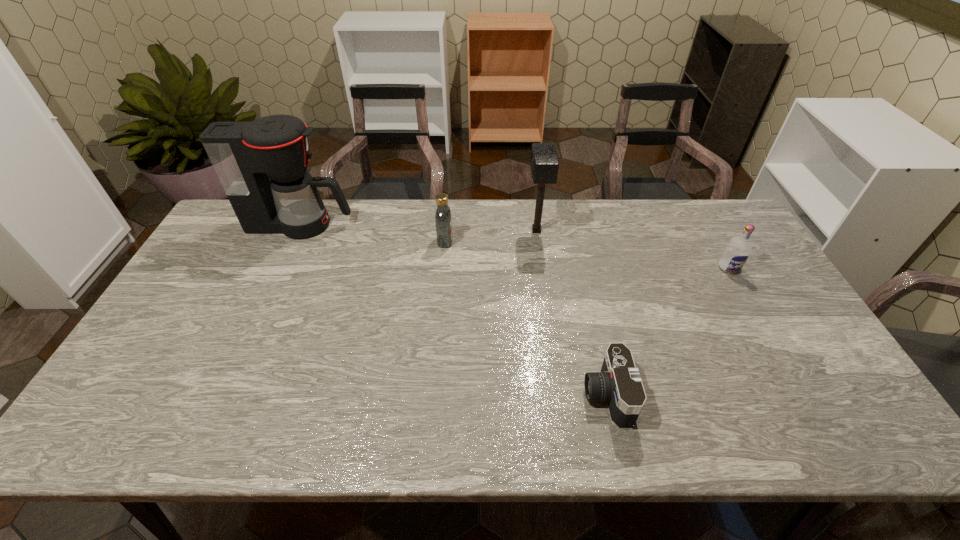
Identify the location of vacant space positioned pour from the carafe of the leftmost object. (417, 225).

In order to click on vacant space located 0.120m on the left of the second tallest object in this screenshot , I will do `click(490, 231)`.

Identify the location of free space located 0.370m on the front-facing side of the fourth object from right to left. (564, 241).

You are a GUI agent. You are given a task and a screenshot of the screen. Output one action in this format:
    pyautogui.click(x=<x>, y=<y>)
    Task: Click on the vacant region located 0.360m on the label of the right vodka
    This screenshot has width=960, height=540.
    Given the screenshot: What is the action you would take?
    pyautogui.click(x=792, y=377)

Identify the location of blank area located 0.350m on the front-facing side of the camera. (438, 395).

In order to click on free space located on the front-facing side of the camera in this screenshot , I will do `click(542, 395)`.

This screenshot has width=960, height=540. In order to click on vacant space situated 0.110m on the front-facing side of the camera in this screenshot , I will do [539, 395].

Where is `coffee maker that is at the far edge`? This screenshot has height=540, width=960. coffee maker that is at the far edge is located at coordinates (262, 165).

What are the coordinates of `mallet present at the far edge` in the screenshot? It's located at coord(544,163).

Find the location of `vodka situated at the far edge`. vodka situated at the far edge is located at coordinates (443, 220).